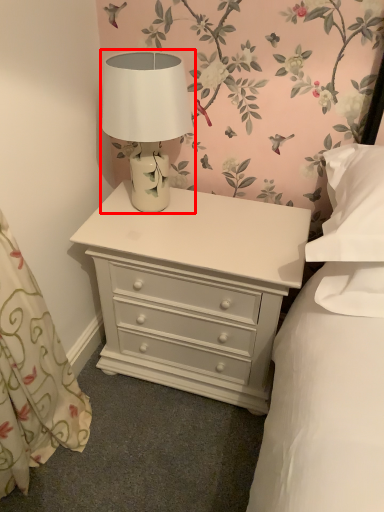
Question: Where is table lamp (annotated by the red box) located in relation to nightstand in the image?

Choices:
 (A) left
 (B) right

Answer: (A)